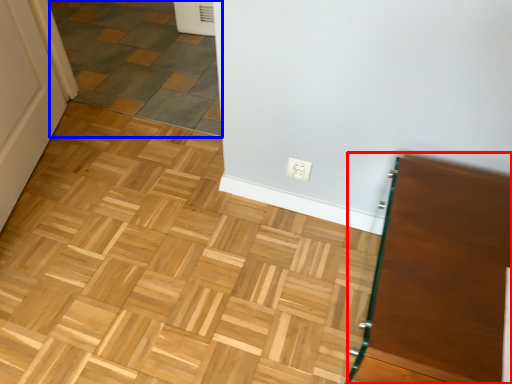
Question: Which of the following is the farthest to the observer, vanity (highlighted by a red box) or tile (highlighted by a blue box)?

Choices:
 (A) vanity
 (B) tile

Answer: (B)